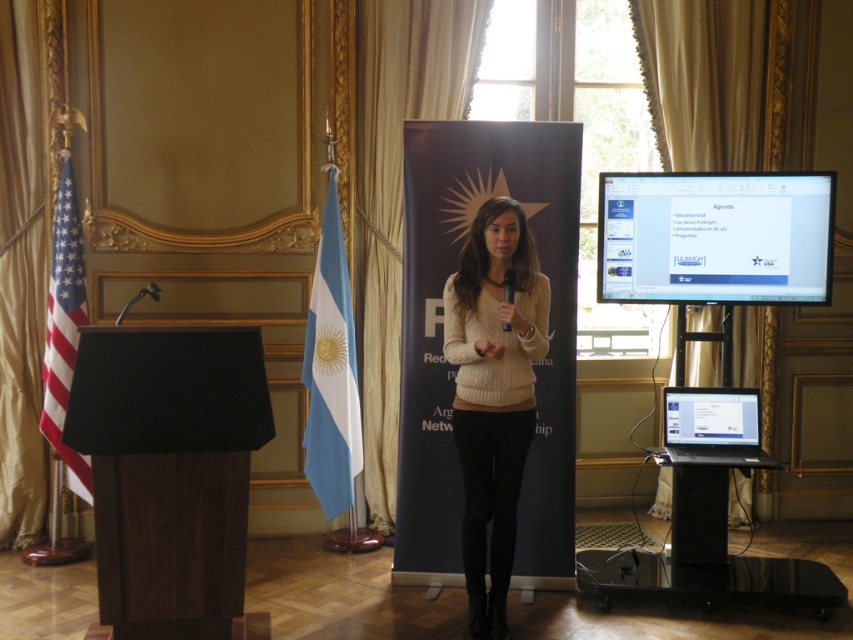
Question: Which of the following is the closest to the observer?

Choices:
 (A) (54, 323)
 (B) (325, 339)
 (C) (512, 477)
 (D) (730, 467)

Answer: (C)

Question: Which object is the farthest from the knit sweater at center?

Choices:
 (A) blue fabric flag at center
 (B) black glossy laptop at lower right
 (C) white glossy screen at upper center
 (D) red-white striped flag at left

Answer: (D)

Question: Which of the following is the farthest from the observer?

Choices:
 (A) blue fabric flag at center
 (B) black glossy laptop at lower right

Answer: (A)

Question: Does white glossy screen at upper center lie behind knit sweater at center?

Choices:
 (A) yes
 (B) no

Answer: (A)

Question: Does knit sweater at center appear on the left side of black glossy laptop at lower right?

Choices:
 (A) no
 (B) yes

Answer: (B)

Question: Does white glossy screen at upper center appear under knit sweater at center?

Choices:
 (A) yes
 (B) no

Answer: (B)